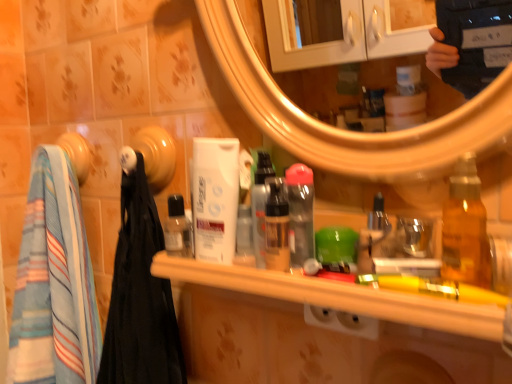
Question: Considering the relative sizes of white matte mouthwash at center, the 2th mouthwash in the left-to-right sequence, and striped cotton towel at left in the image provided, is white matte mouthwash at center, the 2th mouthwash in the left-to-right sequence, thinner than striped cotton towel at left?

Choices:
 (A) no
 (B) yes

Answer: (B)

Question: Would you say white matte mouthwash at center, the 2th mouthwash in the left-to-right sequence, is outside striped cotton towel at left?

Choices:
 (A) yes
 (B) no

Answer: (A)

Question: Can you confirm if white matte mouthwash at center, which is the third mouthwash in right-to-left order, is bigger than striped cotton towel at left?

Choices:
 (A) yes
 (B) no

Answer: (B)

Question: Is white matte mouthwash at center, the 2th mouthwash in the left-to-right sequence, behind striped cotton towel at left?

Choices:
 (A) no
 (B) yes

Answer: (A)

Question: Is white matte mouthwash at center, the 2th mouthwash in the left-to-right sequence, smaller than striped cotton towel at left?

Choices:
 (A) no
 (B) yes

Answer: (B)

Question: Visually, is translucent plastic spray bottle at center, marked as the 1th bottle in a back-to-front arrangement, positioned to the left or to the right of striped cotton towel at left?

Choices:
 (A) right
 (B) left

Answer: (A)

Question: Is translucent plastic spray bottle at center, marked as the 1th bottle in a back-to-front arrangement, inside or outside of striped cotton towel at left?

Choices:
 (A) inside
 (B) outside

Answer: (B)

Question: From their relative heights in the image, would you say translucent plastic spray bottle at center, marked as the 1th bottle in a back-to-front arrangement, is taller or shorter than striped cotton towel at left?

Choices:
 (A) short
 (B) tall

Answer: (A)

Question: From a real-world perspective, relative to striped cotton towel at left, is translucent plastic spray bottle at center, the 1th bottle positioned from the left, vertically above or below?

Choices:
 (A) below
 (B) above

Answer: (B)

Question: Visually, is white matte mouthwash at center, the 2th mouthwash in the left-to-right sequence, positioned to the left or to the right of translucent amber bottle at right, positioned as the second bottle in left-to-right order?

Choices:
 (A) left
 (B) right

Answer: (A)

Question: From the image's perspective, is white matte mouthwash at center, which is the third mouthwash in right-to-left order, positioned above or below translucent amber bottle at right, positioned as the second bottle in left-to-right order?

Choices:
 (A) below
 (B) above

Answer: (B)

Question: In the image, is white matte mouthwash at center, which is the third mouthwash in right-to-left order, positioned in front of or behind translucent amber bottle at right, positioned as the second bottle in left-to-right order?

Choices:
 (A) behind
 (B) front

Answer: (A)

Question: From a real-world perspective, is white matte mouthwash at center, the 2th mouthwash in the left-to-right sequence, above or below translucent amber bottle at right, acting as the 1th bottle starting from the front?

Choices:
 (A) below
 (B) above

Answer: (B)

Question: From the image's perspective, is white matte mouthwash at center, the 2th mouthwash in the left-to-right sequence, positioned above or below translucent plastic spray bottle at center, acting as the second bottle starting from the right?

Choices:
 (A) below
 (B) above

Answer: (B)

Question: Looking at the image, does white matte mouthwash at center, which is the third mouthwash in right-to-left order, seem bigger or smaller compared to translucent plastic spray bottle at center, the 1th bottle positioned from the left?

Choices:
 (A) small
 (B) big

Answer: (B)